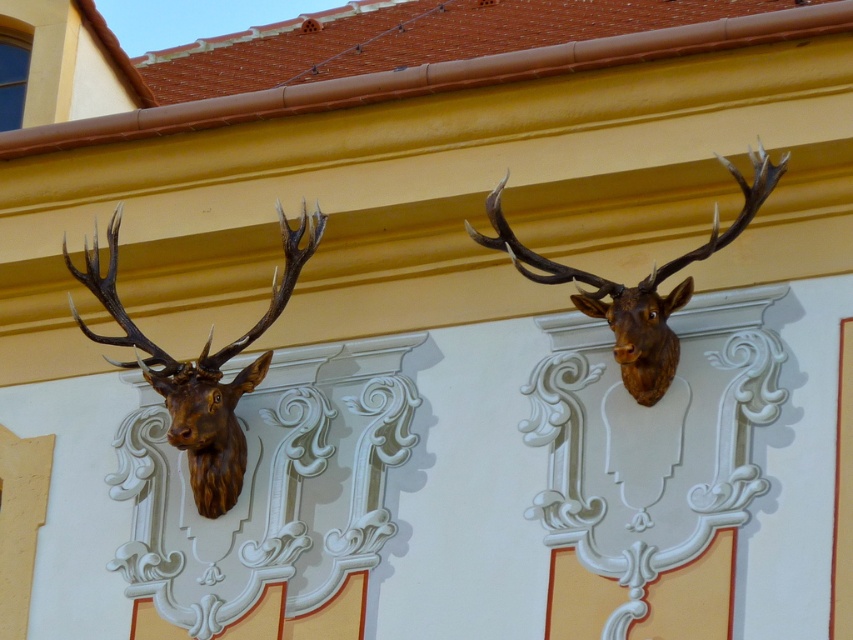
You are an interior designer assessing the placement of two deer heads on a light cream wall. The brown wooden deer head at left and the brown polished wood deer head at upper center are part of a classical design. Which deer head is positioned further to the left?

The brown wooden deer head at left is positioned further to the left compared to the brown polished wood deer head at upper center.

You are an interior designer planning to install a new wall hanging between the brown wooden deer head at left and the brown polished wood deer head at upper center. The hanging requires a space of 4 meters between the two deer heads. Can you safely install it based on their current spacing?

The brown wooden deer head at left and the brown polished wood deer head at upper center are 4.70 meters apart, which is more than the required 4 meters. Therefore, you can safely install the new wall hanging between them.

You are standing in front of the building with two mounted deer heads. You notice two specific points on the wall marked as point 1 and point 2. Point 1 is at coordinates (199, 483) and point 2 is at (625, 349). Based on their positions, which point is closer to you?

Point 1 at (199, 483) is closer to you because it is further to the viewer than point 2 at (625, 349).